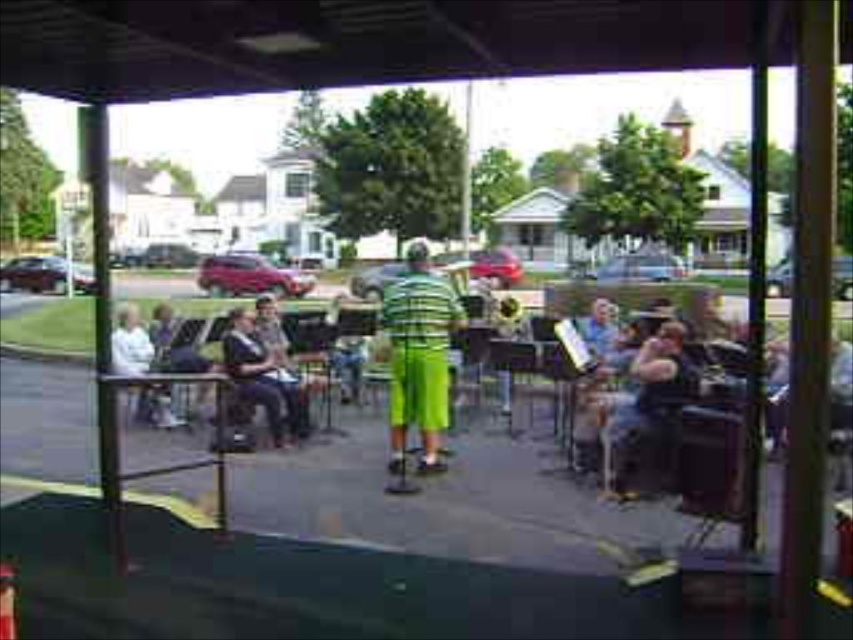
Does green striped shirt at center have a lesser width compared to dark blue fabric jacket at center?

Incorrect, green striped shirt at center's width is not less than dark blue fabric jacket at center's.

Between green striped shirt at center and dark blue fabric jacket at center, which one appears on the left side from the viewer's perspective?

From the viewer's perspective, green striped shirt at center appears more on the left side.

You are a GUI agent. You are given a task and a screenshot of the screen. Output one action in this format:
    pyautogui.click(x=<x>, y=<y>)
    Task: Click on the green striped shirt at center
    Image resolution: width=853 pixels, height=640 pixels.
    Given the screenshot: What is the action you would take?
    pyautogui.click(x=419, y=356)

Is dark blue fabric jacket at center thinner than white fabric shirt at left?

In fact, dark blue fabric jacket at center might be wider than white fabric shirt at left.

Between dark blue fabric jacket at center and white fabric shirt at left, which one is positioned lower?

Positioned lower is dark blue fabric jacket at center.

Which is behind, point (241, 326) or point (137, 323)?

The point (137, 323) is more distant.

This screenshot has height=640, width=853. I want to click on dark blue fabric jacket at center, so click(257, 374).

This screenshot has width=853, height=640. What do you see at coordinates (419, 356) in the screenshot?
I see `green striped shirt at center` at bounding box center [419, 356].

Is green striped shirt at center bigger than white fabric shirt at left?

Correct, green striped shirt at center is larger in size than white fabric shirt at left.

The height and width of the screenshot is (640, 853). What do you see at coordinates (419, 356) in the screenshot?
I see `green striped shirt at center` at bounding box center [419, 356].

Where is `green striped shirt at center`? green striped shirt at center is located at coordinates click(x=419, y=356).